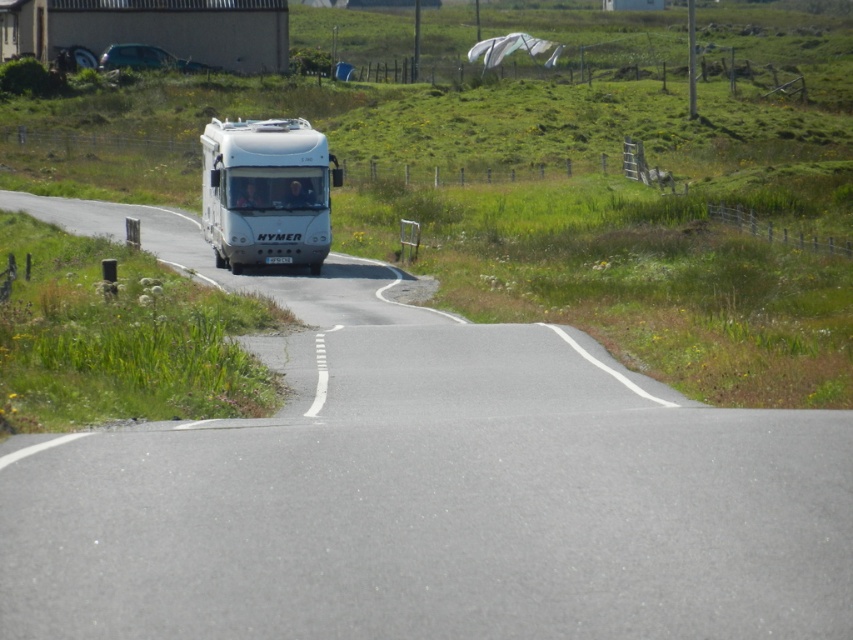
Question: Which point is closer to the camera?

Choices:
 (A) metallic silver rv at upper left
 (B) white glossy bus at center

Answer: (B)

Question: Is white glossy bus at center bigger than metallic silver rv at upper left?

Choices:
 (A) yes
 (B) no

Answer: (A)

Question: Does white glossy bus at center appear over metallic silver rv at upper left?

Choices:
 (A) yes
 (B) no

Answer: (B)

Question: Does white glossy bus at center have a lesser width compared to metallic silver rv at upper left?

Choices:
 (A) yes
 (B) no

Answer: (B)

Question: Which point appears farthest from the camera in this image?

Choices:
 (A) (322, 214)
 (B) (126, 48)

Answer: (B)